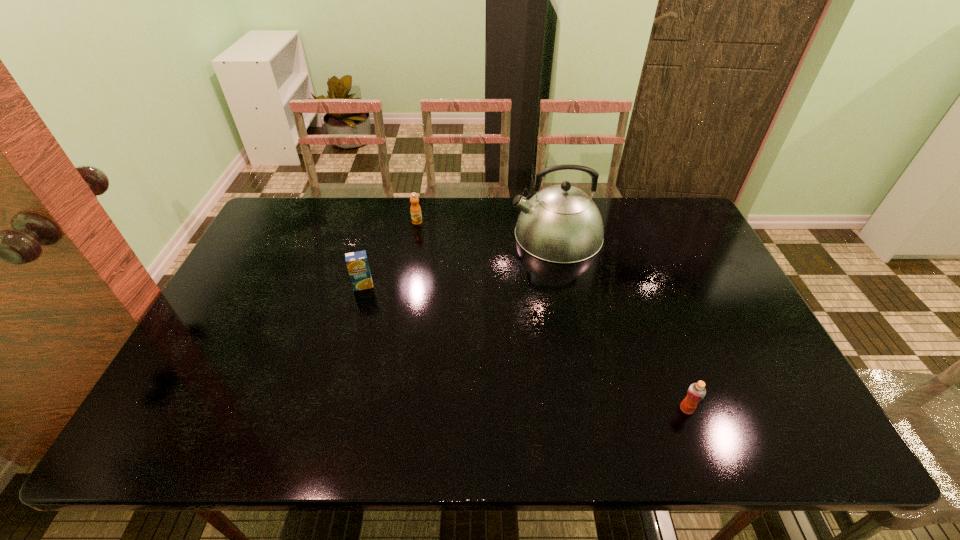
The image size is (960, 540). Find the location of `vacant region at the right edge`. vacant region at the right edge is located at coordinates (722, 296).

You are a GUI agent. You are given a task and a screenshot of the screen. Output one action in this format:
    pyautogui.click(x=<x>, y=<y>)
    Task: Click on the free location at the far left corner
    The width and height of the screenshot is (960, 540).
    Given the screenshot: What is the action you would take?
    pyautogui.click(x=276, y=217)

Locate an element on the screen. The width and height of the screenshot is (960, 540). vacant space at the near right corner is located at coordinates (764, 423).

You are a GUI agent. You are given a task and a screenshot of the screen. Output one action in this format:
    pyautogui.click(x=<x>, y=<y>)
    Task: Click on the free space between the tallest object and the nearest orange juice
    Image resolution: width=960 pixels, height=540 pixels.
    Given the screenshot: What is the action you would take?
    pyautogui.click(x=621, y=322)

Where is `vacant point located between the second orange juice from right to left and the third object from left to right`? vacant point located between the second orange juice from right to left and the third object from left to right is located at coordinates (487, 228).

At what (x,y) coordinates should I click in order to perform the action: click on vacant point located between the nearest object and the kettle. Please return your answer as a coordinate pair (x, y). This screenshot has height=540, width=960. Looking at the image, I should click on (621, 322).

What are the coordinates of `unoccupied position between the second nearest orange juice and the farthest orange juice` in the screenshot? It's located at (390, 254).

Find the location of `vacant point located between the kettle and the second orange juice from right to left`. vacant point located between the kettle and the second orange juice from right to left is located at coordinates pyautogui.click(x=487, y=228).

The height and width of the screenshot is (540, 960). I want to click on vacant area that lies between the second object from left to right and the tallest object, so click(487, 228).

Locate an element on the screen. The height and width of the screenshot is (540, 960). free space between the farthest orange juice and the leftmost object is located at coordinates (390, 254).